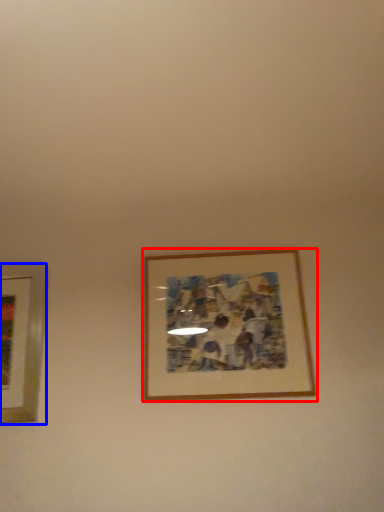
Question: Among these objects, which one is nearest to the camera, picture frame (highlighted by a red box) or picture frame (highlighted by a blue box)?

Choices:
 (A) picture frame
 (B) picture frame

Answer: (A)